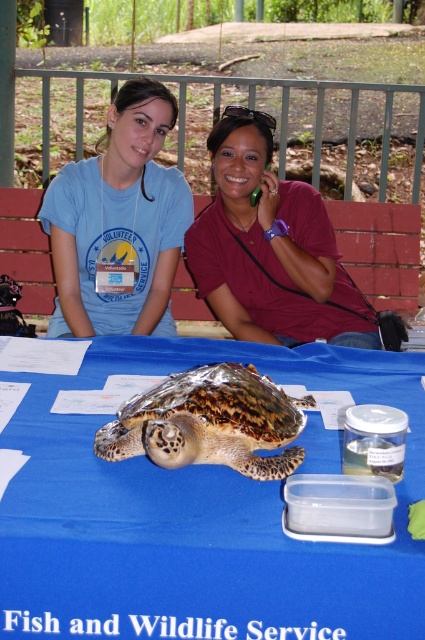
Question: Which point is farther to the camera?

Choices:
 (A) matte maroon shirt at center
 (B) leathery brown turtle at center
 (C) matte blue t-shirt at upper left

Answer: (C)

Question: Does matte maroon shirt at center appear on the right side of metallic green phone at upper center?

Choices:
 (A) no
 (B) yes

Answer: (A)

Question: Among these points, which one is nearest to the camera?

Choices:
 (A) (258, 192)
 (B) (102, 320)
 (C) (200, 253)
 (D) (147, 454)

Answer: (D)

Question: Can you confirm if matte blue t-shirt at upper left is bigger than metallic green phone at upper center?

Choices:
 (A) yes
 (B) no

Answer: (A)

Question: Does matte blue t-shirt at upper left come in front of matte maroon shirt at center?

Choices:
 (A) no
 (B) yes

Answer: (A)

Question: Estimate the real-world distances between objects in this image. Which object is farther from the matte blue t-shirt at upper left?

Choices:
 (A) leathery brown turtle at center
 (B) matte maroon shirt at center
 (C) metallic green phone at upper center

Answer: (A)